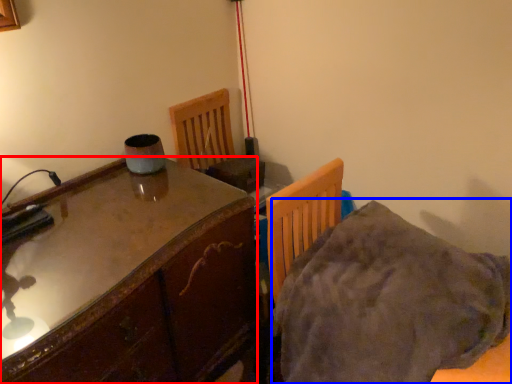
Question: Which of the following is the farthest to the observer, table (highlighted by a red box) or blanket (highlighted by a blue box)?

Choices:
 (A) table
 (B) blanket

Answer: (A)